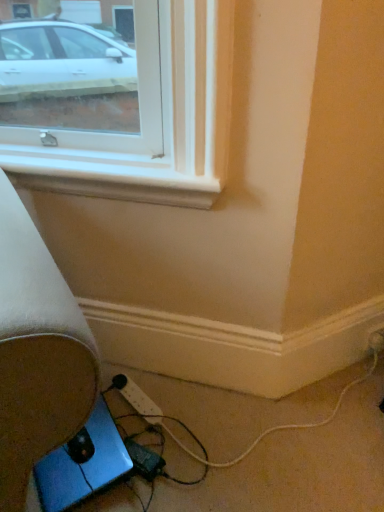
Question: From the image's perspective, does white plastic power strip at lower right appear lower than blue metallic laptop at lower left?

Choices:
 (A) no
 (B) yes

Answer: (A)

Question: Considering the relative sizes of white plastic power strip at lower right and blue metallic laptop at lower left in the image provided, is white plastic power strip at lower right thinner than blue metallic laptop at lower left?

Choices:
 (A) yes
 (B) no

Answer: (A)

Question: Does white plastic power strip at lower right contain blue metallic laptop at lower left?

Choices:
 (A) yes
 (B) no

Answer: (B)

Question: From a real-world perspective, does white plastic power strip at lower right stand above blue metallic laptop at lower left?

Choices:
 (A) no
 (B) yes

Answer: (B)

Question: From the image's perspective, does white plastic power strip at lower right appear higher than blue metallic laptop at lower left?

Choices:
 (A) no
 (B) yes

Answer: (B)

Question: Could you tell me if white plastic power strip at lower right is facing blue metallic laptop at lower left?

Choices:
 (A) yes
 (B) no

Answer: (B)

Question: From the image's perspective, is white plastic power strip at lower right under black plastic extension cord at lower center, which is counted as the 1th extension cord, starting from the front?

Choices:
 (A) no
 (B) yes

Answer: (A)

Question: From a real-world perspective, does white plastic power strip at lower right sit lower than black plastic extension cord at lower center, which appears as the 2th extension cord when viewed from the back?

Choices:
 (A) no
 (B) yes

Answer: (A)

Question: Is white plastic power strip at lower right thinner than black plastic extension cord at lower center, which appears as the 2th extension cord when viewed from the back?

Choices:
 (A) no
 (B) yes

Answer: (B)

Question: From a real-world perspective, is white plastic power strip at lower right physically above black plastic extension cord at lower center, which is counted as the 1th extension cord, starting from the front?

Choices:
 (A) yes
 (B) no

Answer: (A)

Question: Would you say black plastic extension cord at lower center, which is counted as the 1th extension cord, starting from the front, is part of white plastic power strip at lower right's contents?

Choices:
 (A) no
 (B) yes

Answer: (A)

Question: Is white plastic power strip at lower right wider than black plastic extension cord at lower center, which is counted as the 1th extension cord, starting from the front?

Choices:
 (A) no
 (B) yes

Answer: (A)

Question: Is blue metallic laptop at lower left smaller than white plastic power strip at lower right?

Choices:
 (A) yes
 (B) no

Answer: (B)